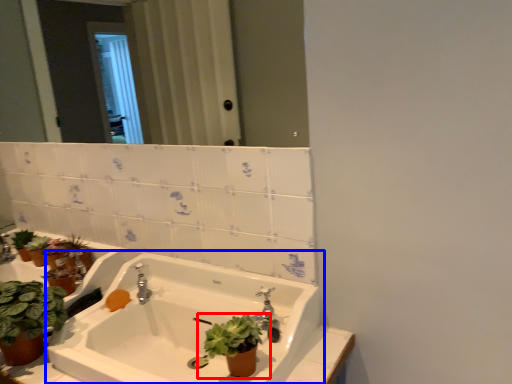
Question: Which object is closer to the camera taking this photo, houseplant (highlighted by a red box) or sink (highlighted by a blue box)?

Choices:
 (A) houseplant
 (B) sink

Answer: (B)